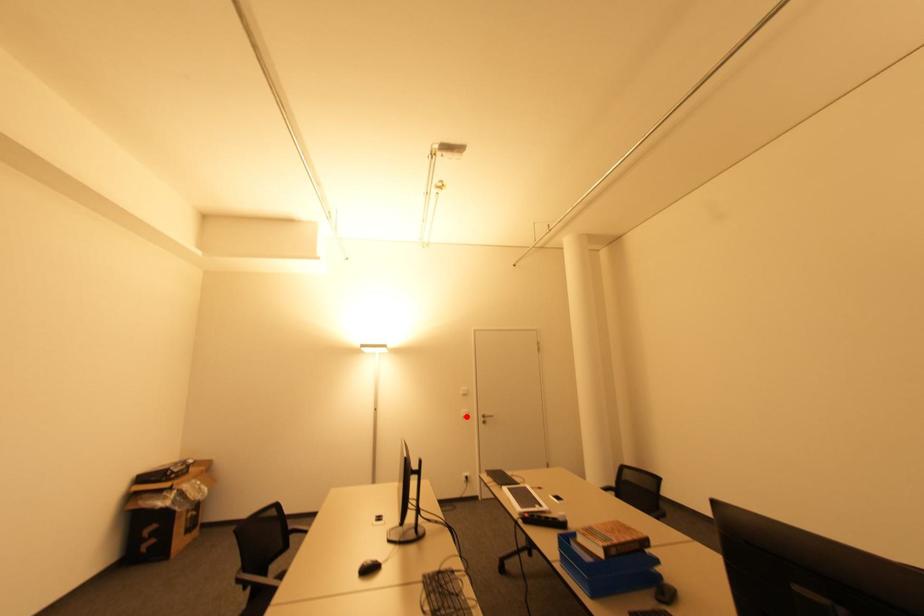
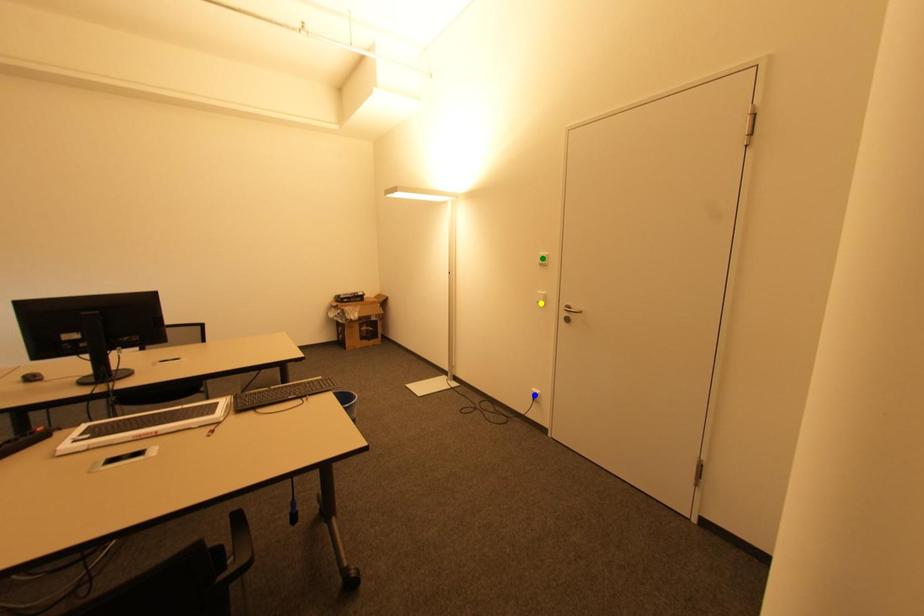
Question: I am providing you with two images of the same scene from different viewpoints. A red point is marked on the first image. You are given multiple points on the second image. Which mark in image 2 goes with the point in image 1?

Choices:
 (A) yellow point
 (B) blue point
 (C) green point

Answer: (A)